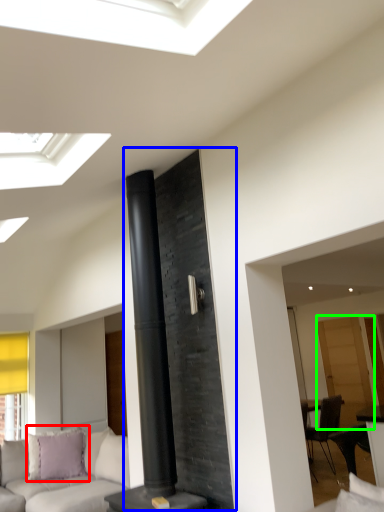
Question: Based on their relative distances, which object is farther from pillow (highlighted by a red box)? Choose from fireplace (highlighted by a blue box) and glass door (highlighted by a green box).

Choices:
 (A) fireplace
 (B) glass door

Answer: (B)